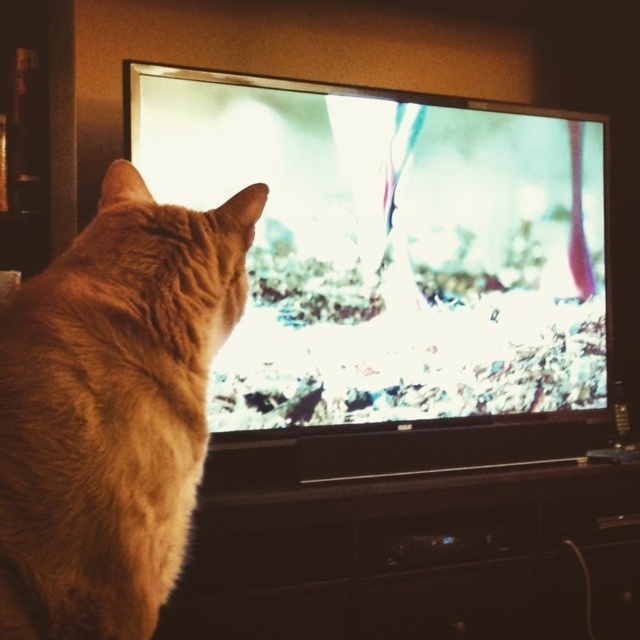
Is matte screen at center further to the viewer compared to orange fur cat at left?

Yes, it is.

Which is above, matte screen at center or orange fur cat at left?

matte screen at center

Which is behind, point (525, 296) or point (218, 296)?

The point (525, 296) is behind.

Where is `matte screen at center`? The width and height of the screenshot is (640, 640). matte screen at center is located at coordinates (394, 268).

Does orange fur cat at left appear under black plastic entertainment center at lower center?

No, orange fur cat at left is not below black plastic entertainment center at lower center.

This screenshot has width=640, height=640. What do you see at coordinates (113, 410) in the screenshot?
I see `orange fur cat at left` at bounding box center [113, 410].

Is point (80, 500) behind point (436, 564)?

That is False.

I want to click on orange fur cat at left, so click(x=113, y=410).

Between matte screen at center and black plastic entertainment center at lower center, which one appears on the left side from the viewer's perspective?

matte screen at center

From the picture: Does matte screen at center appear under black plastic entertainment center at lower center?

Incorrect, matte screen at center is not positioned below black plastic entertainment center at lower center.

Between point (500, 147) and point (406, 588), which one is positioned in front?

Point (406, 588)

The width and height of the screenshot is (640, 640). I want to click on matte screen at center, so click(394, 268).